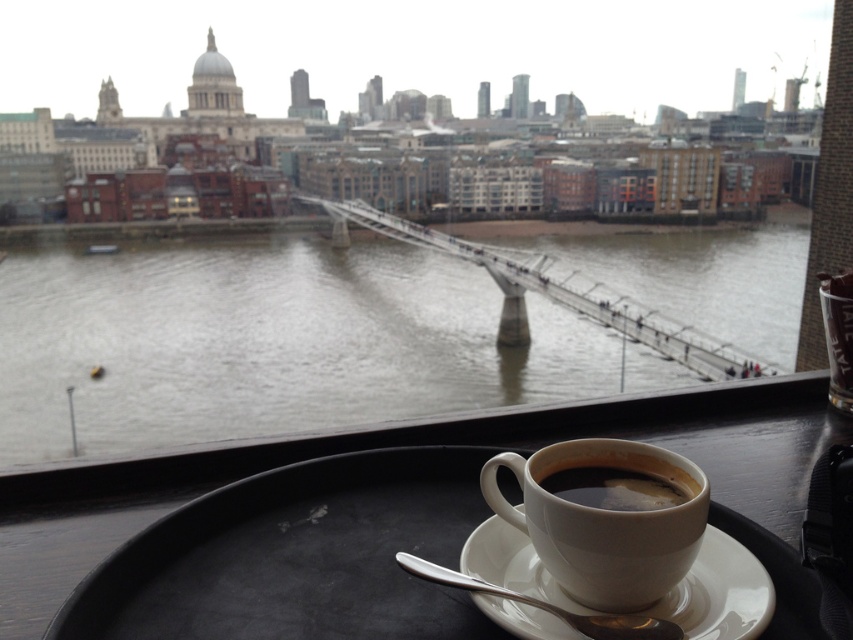
Between brown water at center and black matte tray at lower center, which one appears on the left side from the viewer's perspective?

brown water at center

Can you confirm if brown water at center is positioned to the right of black matte tray at lower center?

No, brown water at center is not to the right of black matte tray at lower center.

Does point (598, 262) come farther from viewer compared to point (424, 422)?

Yes, it is behind point (424, 422).

Find the location of a particular element. The image size is (853, 640). brown water at center is located at coordinates (264, 342).

Which is behind, point (531, 536) or point (589, 611)?

Positioned behind is point (531, 536).

Can you confirm if white ceramic cup at center is bigger than white ceramic saucer at lower center?

Yes, white ceramic cup at center is bigger than white ceramic saucer at lower center.

Locate an element on the screen. white ceramic cup at center is located at coordinates (605, 522).

Measure the distance from black matte tray at lower center to white ceramic saucer at lower center.

black matte tray at lower center is 8.10 inches away from white ceramic saucer at lower center.

Consider the image. Which of these two, black matte tray at lower center or white ceramic saucer at lower center, stands taller?

With more height is black matte tray at lower center.

This screenshot has width=853, height=640. Describe the element at coordinates (408, 448) in the screenshot. I see `black matte tray at lower center` at that location.

Identify the location of black matte tray at lower center. The height and width of the screenshot is (640, 853). (408, 448).